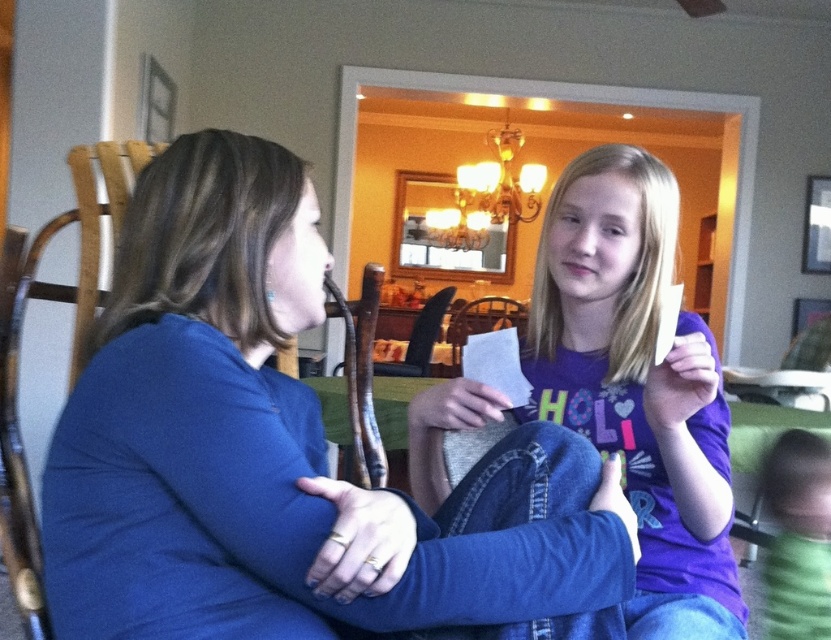
Consider the image. Is blue fabric shirt at center positioned in front of purple cotton shirt at center?

Yes, blue fabric shirt at center is closer to the viewer.

Is point (298, 586) farther from viewer compared to point (662, 248)?

No, (298, 586) is closer to viewer.

What are the coordinates of `blue fabric shirt at center` in the screenshot? It's located at (x=283, y=452).